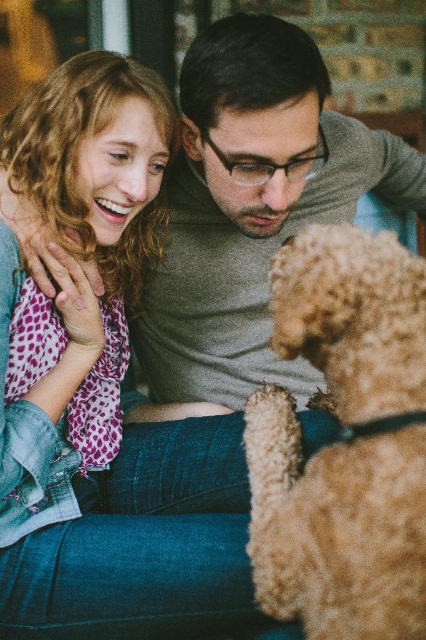
You are trying to decide where to place a new rug in the living room. The rug must be large enough to cover both the fuzzy golden dog at lower right and the gray matte sweater at center. Based on their sizes, what should the minimum width of the rug be?

The fuzzy golden dog at lower right has a lesser width compared to gray matte sweater at center. Therefore, the minimum width of the rug should be at least the width of the gray matte sweater at center to ensure both items are covered.

You are a photographer setting up a shot in this scene. You need to ensure that the matte pink scarf at upper left is visible in the frame without being blocked by the fuzzy golden dog at lower right. Based on their positions, do you think the scarf will be visible?

The matte pink scarf at upper left is positioned over the fuzzy golden dog at lower right, meaning it is placed above the dog. Since the scarf is above the dog, it should remain visible in the frame and not blocked by the dog.

You are standing in the living room and want to place a new picture frame exactly where the matte pink scarf at upper left is currently located. What coordinates should you aim for to place the frame in the exact same spot?

The coordinates for the matte pink scarf at upper left are at point [114,508]. Place the picture frame there.